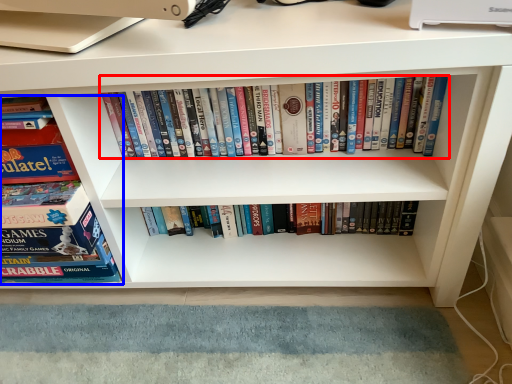
Question: Which of the following is the farthest to the observer, book (highlighted by a red box) or book (highlighted by a blue box)?

Choices:
 (A) book
 (B) book

Answer: (A)